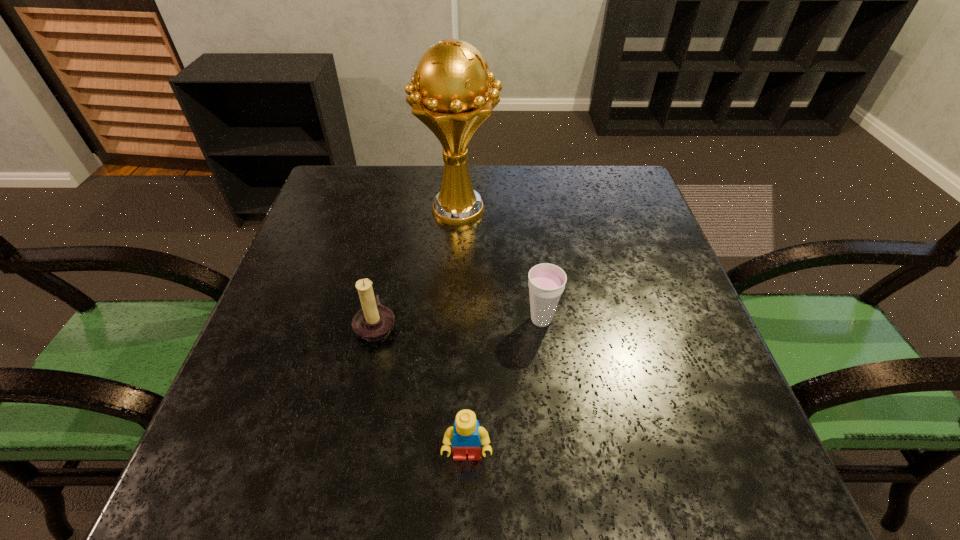
Identify the location of trophy_cup. (450, 92).

Locate an element on the screen. Image resolution: width=960 pixels, height=540 pixels. the farthest object is located at coordinates (450, 92).

In order to click on candle holder in this screenshot , I will do `click(373, 322)`.

Where is `the rightmost object`? The image size is (960, 540). the rightmost object is located at coordinates (546, 283).

Where is `the nearest object`? This screenshot has width=960, height=540. the nearest object is located at coordinates (466, 436).

The height and width of the screenshot is (540, 960). I want to click on free space located 0.070m at the front of the farthest object where the globe is prominent, so (x=456, y=255).

The image size is (960, 540). In order to click on vacant area located on the wick of the candle holder in this screenshot , I will do `click(553, 324)`.

What are the coordinates of `vacant space located 0.060m on the right of the cup` in the screenshot? It's located at (588, 320).

Where is `object that is at the far edge`? The height and width of the screenshot is (540, 960). object that is at the far edge is located at coordinates (450, 92).

This screenshot has height=540, width=960. What are the coordinates of `object at the near edge` in the screenshot? It's located at (466, 436).